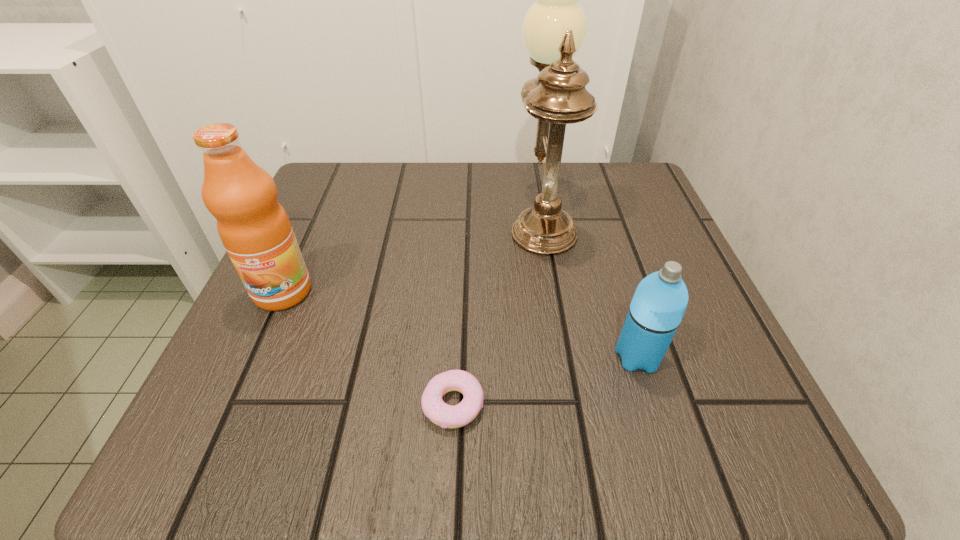
Where is `vacant space at the far left corner`? This screenshot has width=960, height=540. vacant space at the far left corner is located at coordinates (346, 185).

Locate an element on the screen. The width and height of the screenshot is (960, 540). vacant space at the far right corner is located at coordinates (632, 166).

Locate an element on the screen. The height and width of the screenshot is (540, 960). free space at the near right corner of the desktop is located at coordinates (710, 407).

This screenshot has width=960, height=540. What are the coordinates of `unoccupied area between the tallest object and the rightmost object` in the screenshot? It's located at (589, 285).

Locate an element on the screen. unoccupied area between the third farthest object and the oil lamp is located at coordinates (589, 285).

You are a GUI agent. You are given a task and a screenshot of the screen. Output one action in this format:
    pyautogui.click(x=<x>, y=<y>)
    Task: Click on the blank region between the leftmost object and the third object from right to left
    
    Given the screenshot: What is the action you would take?
    pyautogui.click(x=368, y=348)

The width and height of the screenshot is (960, 540). I want to click on vacant space that is in between the second farthest object and the second object from left to right, so click(368, 348).

Image resolution: width=960 pixels, height=540 pixels. In order to click on free space between the second object from left to right and the tallest object in this screenshot , I will do `click(497, 309)`.

You are a GUI agent. You are given a task and a screenshot of the screen. Output one action in this format:
    pyautogui.click(x=<x>, y=<y>)
    Task: Click on the free space that is in between the third object from right to left and the oil lamp
    The width and height of the screenshot is (960, 540).
    Given the screenshot: What is the action you would take?
    pyautogui.click(x=497, y=309)

The image size is (960, 540). In order to click on vacant point located between the nearest object and the second nearest object in this screenshot , I will do `click(545, 380)`.